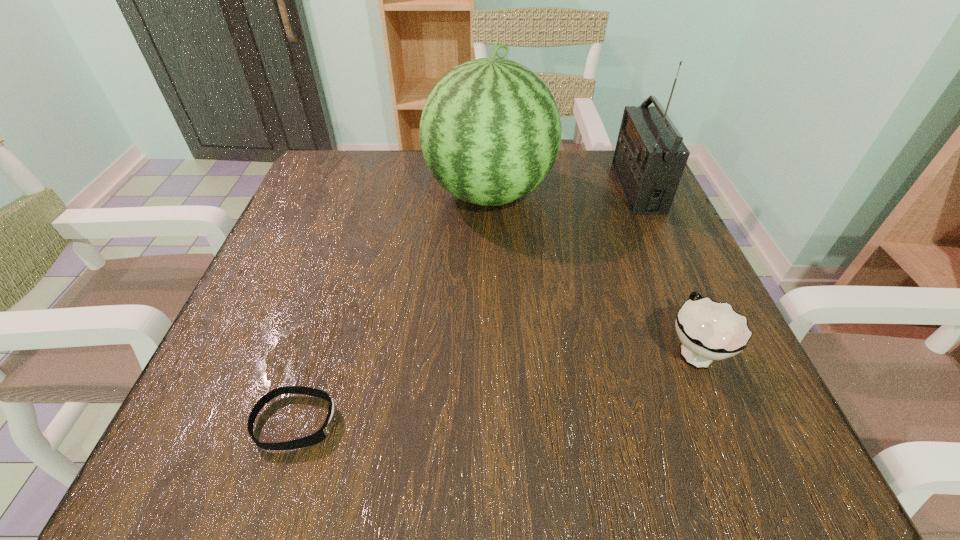
Locate an element on the screen. This screenshot has height=540, width=960. object that is at the near left corner is located at coordinates click(x=322, y=433).

Find the location of a particular element. The image size is (960, 540). object located in the far right corner section of the desktop is located at coordinates (649, 159).

Identify the location of vacant space at the far edge. (391, 150).

The image size is (960, 540). Identify the location of free space at the near edge. (601, 423).

In the image, there is a desktop. Identify the location of vacant area at the left edge. The image size is (960, 540). (318, 228).

The height and width of the screenshot is (540, 960). I want to click on vacant area at the near right corner, so click(x=664, y=447).

This screenshot has width=960, height=540. I want to click on free spot between the leftmost object and the second object from left to right, so click(x=393, y=308).

The image size is (960, 540). I want to click on empty space between the radio receiver and the third object from right to left, so click(564, 191).

The height and width of the screenshot is (540, 960). Find the location of `empty space that is in between the radio receiver and the second object from left to right`. empty space that is in between the radio receiver and the second object from left to right is located at coordinates pyautogui.click(x=564, y=191).

Find the location of `vacant area between the nearest object and the watermelon`. vacant area between the nearest object and the watermelon is located at coordinates (393, 308).